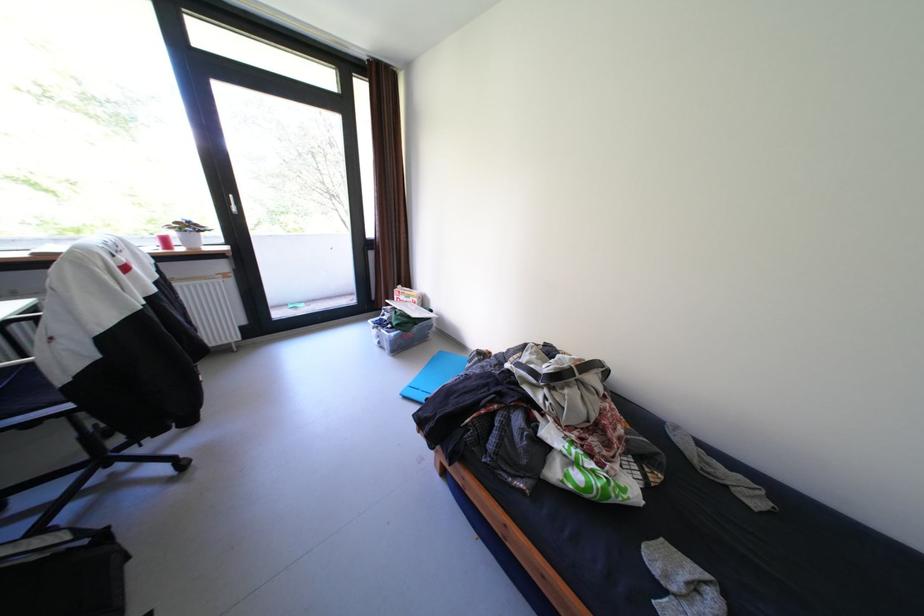
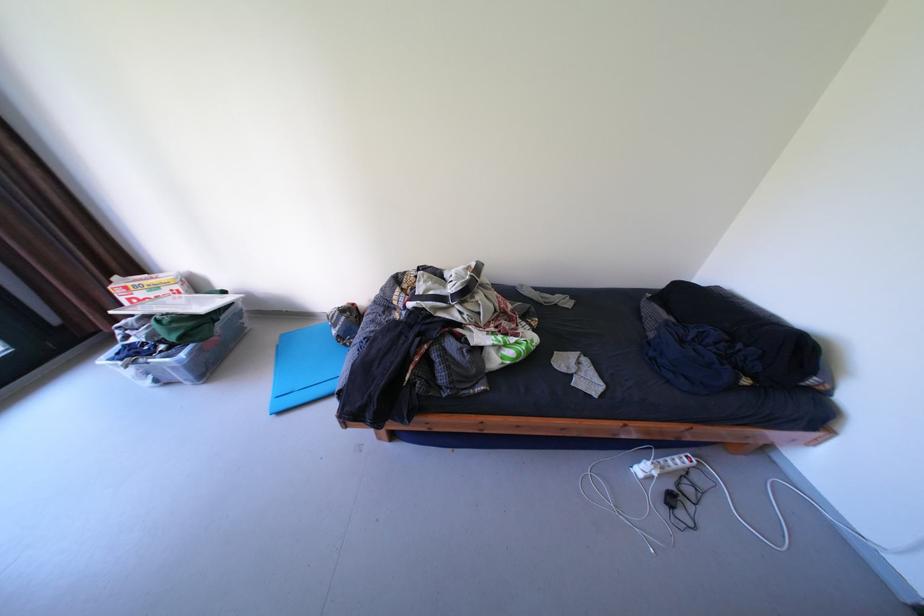
Find the pixel in the second image that matches point (403, 334) in the first image.

(193, 355)